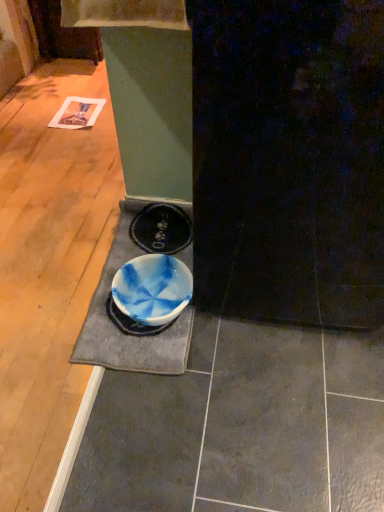
What do you see at coordinates (119, 330) in the screenshot? Image resolution: width=384 pixels, height=512 pixels. I see `blue marbled doormat at center` at bounding box center [119, 330].

I want to click on blue marbled doormat at center, so click(119, 330).

Describe the element at coordinates (152, 289) in the screenshot. The height and width of the screenshot is (512, 384). I see `blue marbled bowl at center` at that location.

The width and height of the screenshot is (384, 512). Identify the location of blue marbled bowl at center. (152, 289).

Find the location of `blue marbled doormat at center`. blue marbled doormat at center is located at coordinates (119, 330).

Is blue marbled doormat at center to the left or to the right of blue marbled bowl at center in the image?

From the image, it's evident that blue marbled doormat at center is to the left of blue marbled bowl at center.

Is the depth of blue marbled doormat at center less than that of blue marbled bowl at center?

Yes, blue marbled doormat at center is closer to the viewer.

Considering the positions of points (80, 342) and (148, 298), is point (80, 342) closer to camera compared to point (148, 298)?

Yes, point (80, 342) is in front of point (148, 298).

From the image's perspective, which is above, blue marbled doormat at center or blue marbled bowl at center?

From the image's view, blue marbled doormat at center is above.

From a real-world perspective, which is physically below, blue marbled doormat at center or blue marbled bowl at center?

blue marbled doormat at center, from a real-world perspective.

Considering the relative sizes of blue marbled doormat at center and blue marbled bowl at center in the image provided, is blue marbled doormat at center wider than blue marbled bowl at center?

Correct, the width of blue marbled doormat at center exceeds that of blue marbled bowl at center.

Considering the sizes of blue marbled doormat at center and blue marbled bowl at center in the image, is blue marbled doormat at center taller or shorter than blue marbled bowl at center?

blue marbled doormat at center is shorter than blue marbled bowl at center.

Based on the photo, between blue marbled doormat at center and blue marbled bowl at center, which one has larger size?

With larger size is blue marbled doormat at center.

Would you say blue marbled doormat at center contains blue marbled bowl at center?

That's correct, blue marbled bowl at center is inside blue marbled doormat at center.

Is blue marbled doormat at center not near blue marbled bowl at center?

blue marbled doormat at center is actually quite close to blue marbled bowl at center.

Is blue marbled doormat at center facing away from blue marbled bowl at center?

Yes.

This screenshot has width=384, height=512. In order to click on doormat in front of the blue marbled bowl at center in this screenshot , I will do (119, 330).

From the picture: Is blue marbled bowl at center at the left side of blue marbled doormat at center?

No.

Which object is closer to the camera, blue marbled bowl at center or blue marbled doormat at center?

blue marbled doormat at center.

Which is nearer, (149, 304) or (90, 325)?

The point (90, 325) is in front.

From the image's perspective, which object appears higher, blue marbled bowl at center or blue marbled doormat at center?

From the image's view, blue marbled doormat at center is above.

From a real-world perspective, is blue marbled bowl at center located beneath blue marbled doormat at center?

No, from a real-world perspective, blue marbled bowl at center is not below blue marbled doormat at center.

Between blue marbled bowl at center and blue marbled doormat at center, which one has smaller width?

blue marbled bowl at center.

Consider the image. Is blue marbled bowl at center shorter than blue marbled doormat at center?

Incorrect, the height of blue marbled bowl at center does not fall short of that of blue marbled doormat at center.

Which of these two, blue marbled bowl at center or blue marbled doormat at center, is smaller?

blue marbled bowl at center.

Is blue marbled doormat at center a part of blue marbled bowl at center?

Yes, blue marbled bowl at center contains blue marbled doormat at center.

Are blue marbled bowl at center and blue marbled doormat at center making contact?

Yes, blue marbled bowl at center is beside blue marbled doormat at center.

Is blue marbled bowl at center positioned with its back to blue marbled doormat at center?

Yes, blue marbled bowl at center's orientation is away from blue marbled doormat at center.

How different are the orientations of blue marbled bowl at center and blue marbled doormat at center in degrees?

They differ by 0.000642 degrees in their facing directions.

Based on the photo, how much distance is there between blue marbled bowl at center and blue marbled doormat at center?

blue marbled bowl at center and blue marbled doormat at center are 3.19 inches apart from each other.

At what (x,y) coordinates should I click in order to perform the action: click on bowl behind the blue marbled doormat at center. Please return your answer as a coordinate pair (x, y). Looking at the image, I should click on (152, 289).

In the image, there is a blue marbled bowl at center. Identify the location of doormat below it (from a real-world perspective). Image resolution: width=384 pixels, height=512 pixels. (119, 330).

This screenshot has width=384, height=512. I want to click on bowl on the right of blue marbled doormat at center, so click(152, 289).